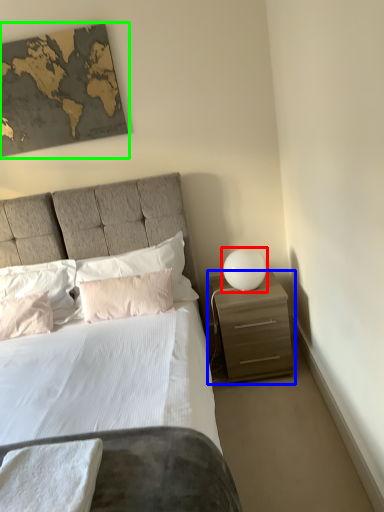
Question: Considering the real-world distances, which object is closest to table lamp (highlighted by a red box)? nightstand (highlighted by a blue box) or picture frame (highlighted by a green box).

Choices:
 (A) nightstand
 (B) picture frame

Answer: (A)